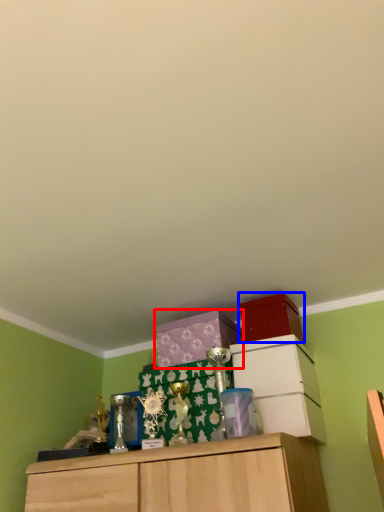
Question: Which object is closer to the camera taking this photo, cabinetry (highlighted by a red box) or storage box (highlighted by a blue box)?

Choices:
 (A) cabinetry
 (B) storage box

Answer: (B)